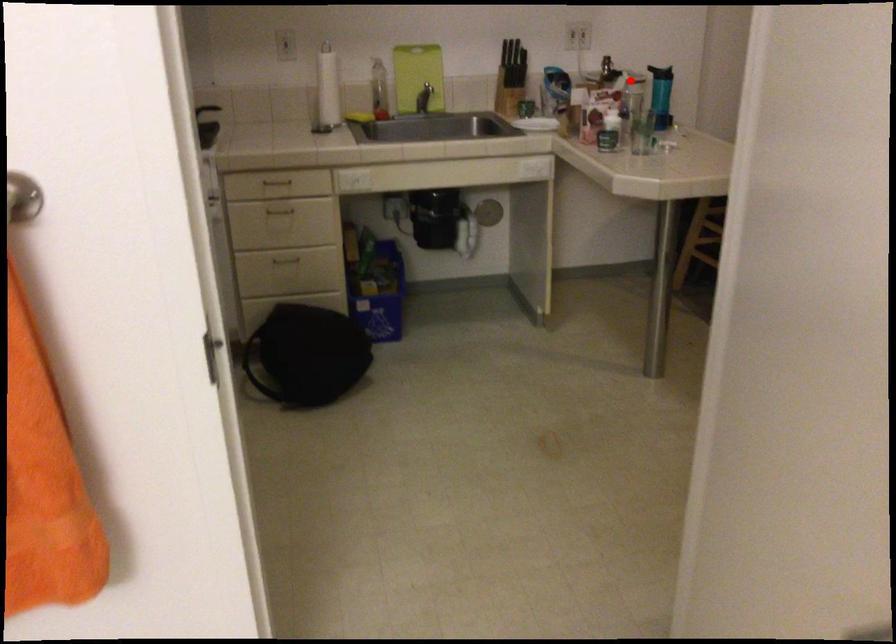
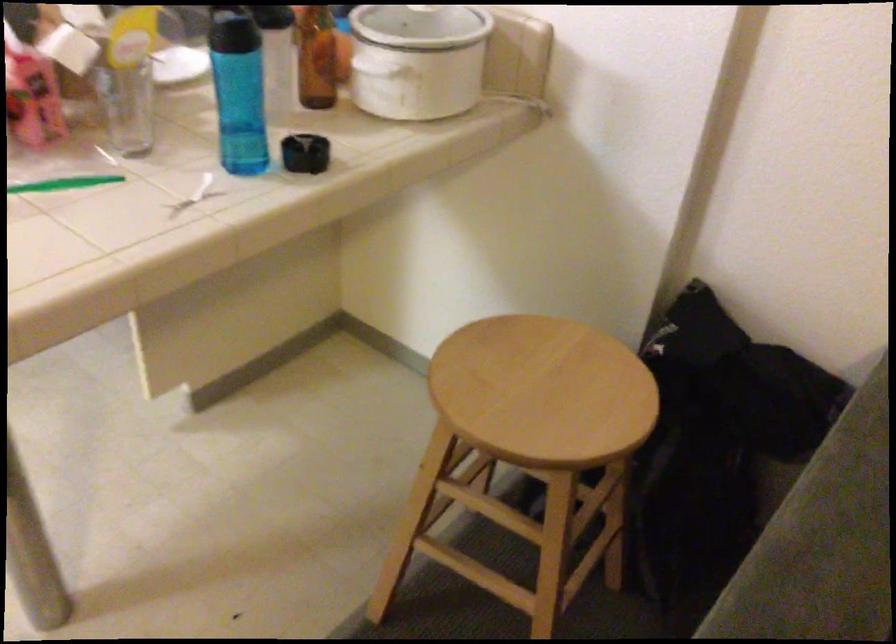
Find the pixel in the second image that matches the highlighted location in the first image.

(418, 60)